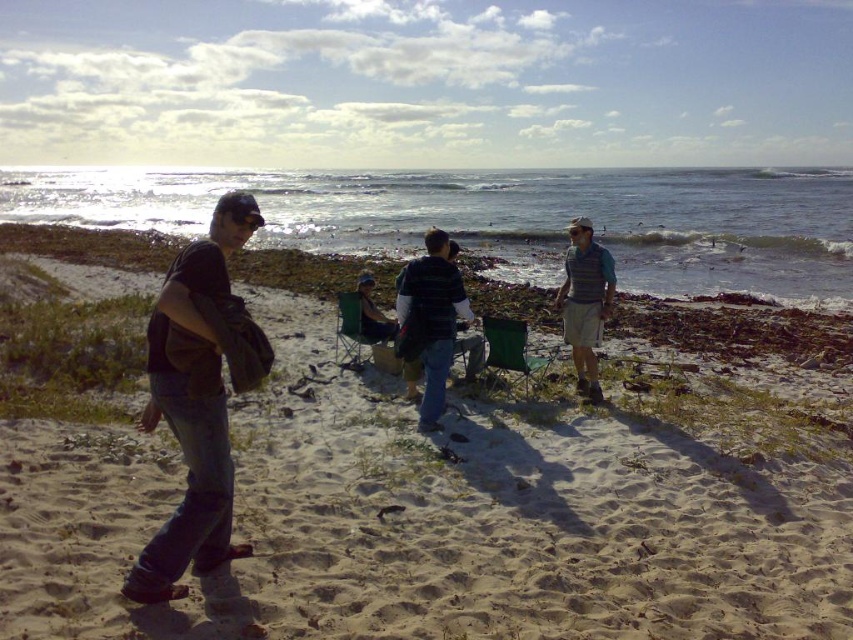
Between clear blue water at upper center and gray knit vest at right, which one appears on the left side from the viewer's perspective?

From the viewer's perspective, clear blue water at upper center appears more on the left side.

Who is shorter, clear blue water at upper center or gray knit vest at right?

Standing shorter between the two is gray knit vest at right.

Does point (798, 225) come closer to viewer compared to point (590, 369)?

No, it is not.

What are the coordinates of `clear blue water at upper center` in the screenshot? It's located at (503, 218).

The image size is (853, 640). What do you see at coordinates (409, 493) in the screenshot?
I see `sandy beach at center` at bounding box center [409, 493].

Can you confirm if sandy beach at center is smaller than gray knit vest at right?

Actually, sandy beach at center might be larger than gray knit vest at right.

Does point (287, 600) come in front of point (585, 353)?

Yes, it is.

Locate an element on the screen. The width and height of the screenshot is (853, 640). sandy beach at center is located at coordinates (409, 493).

Does dark brown leather jacket at left appear under gray knit vest at right?

No, dark brown leather jacket at left is not below gray knit vest at right.

Between dark brown leather jacket at left and gray knit vest at right, which one has less height?

Standing shorter between the two is gray knit vest at right.

Measure the distance between dark brown leather jacket at left and camera.

12.70 feet

The width and height of the screenshot is (853, 640). In order to click on dark brown leather jacket at left in this screenshot , I will do `click(199, 397)`.